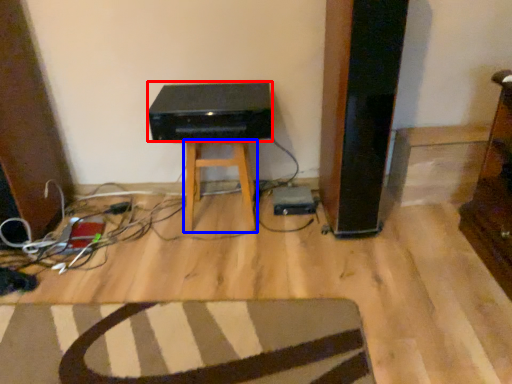
Question: Which point is closer to the camera, stereo (highlighted by a red box) or stool (highlighted by a blue box)?

Choices:
 (A) stereo
 (B) stool

Answer: (A)